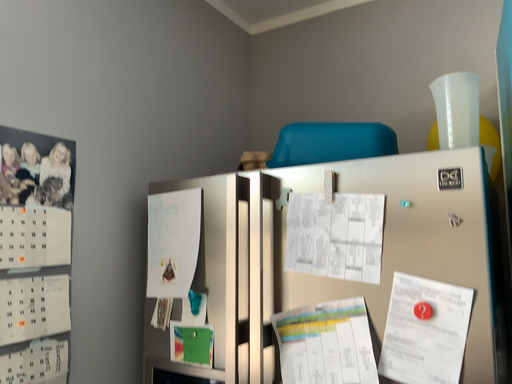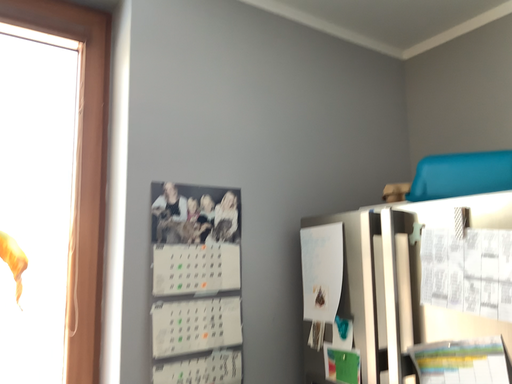
Question: How did the camera likely rotate when shooting the video?

Choices:
 (A) rotated left
 (B) rotated right

Answer: (A)